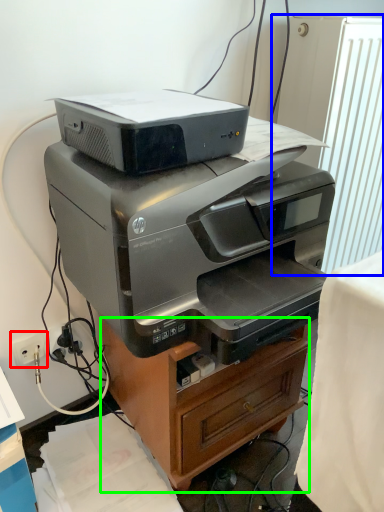
Question: Estimate the real-world distances between objects in this image. Which object is farther from electric outlet (highlighted by a red box), radiator (highlighted by a blue box) or furniture (highlighted by a green box)?

Choices:
 (A) radiator
 (B) furniture

Answer: (A)